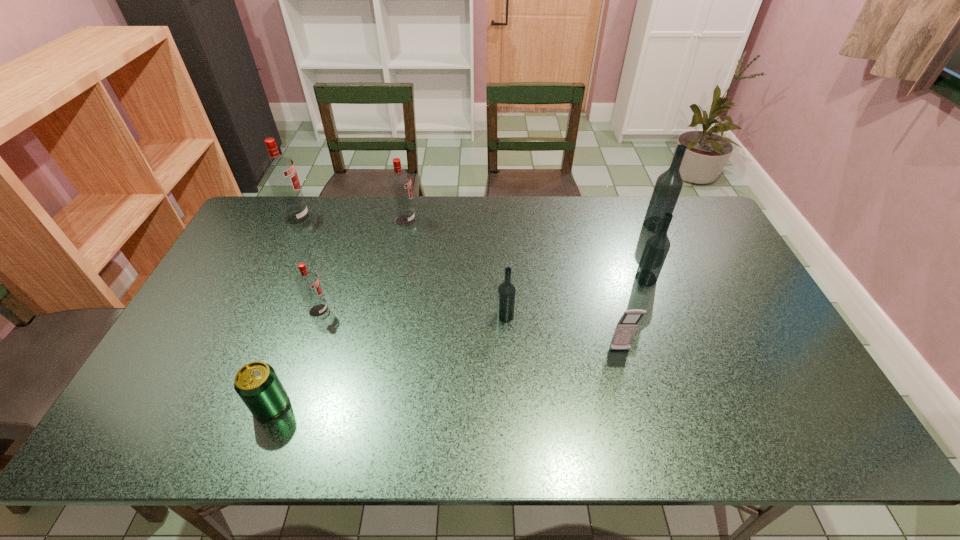
Where is `black vodka that is the closest to the smallest red vodka`? This screenshot has height=540, width=960. black vodka that is the closest to the smallest red vodka is located at coordinates (506, 297).

Where is `black vodka that stands as the third closest to the gray cellular telephone`? The image size is (960, 540). black vodka that stands as the third closest to the gray cellular telephone is located at coordinates (668, 186).

Image resolution: width=960 pixels, height=540 pixels. In order to click on vacant space that satisfies the following two spatial constraints: 1. on the front label of the second nearest black vodka; 2. on the right side of the rightmost red vodka in this screenshot , I will do `click(394, 278)`.

Find the location of a particular element. free space that satisfies the following two spatial constraints: 1. on the front label of the fifth vodka from left to right; 2. on the left side of the third vodka from left to right is located at coordinates point(394,278).

The height and width of the screenshot is (540, 960). Find the location of `free location that satisfies the following two spatial constraints: 1. on the front label of the fourth vodka from left to right; 2. on the right side of the leftmost red vodka`. free location that satisfies the following two spatial constraints: 1. on the front label of the fourth vodka from left to right; 2. on the right side of the leftmost red vodka is located at coordinates (251, 315).

Where is `free location that satisfies the following two spatial constraints: 1. on the front label of the leftmost red vodka; 2. on the right side of the nearest object`? Image resolution: width=960 pixels, height=540 pixels. free location that satisfies the following two spatial constraints: 1. on the front label of the leftmost red vodka; 2. on the right side of the nearest object is located at coordinates (207, 405).

This screenshot has width=960, height=540. Find the location of `vacant space that satisfies the following two spatial constraints: 1. on the back side of the rightmost object; 2. on the front label of the leftmost object`. vacant space that satisfies the following two spatial constraints: 1. on the back side of the rightmost object; 2. on the front label of the leftmost object is located at coordinates [652, 218].

This screenshot has width=960, height=540. Find the location of `vacant space that satisfies the following two spatial constraints: 1. on the front label of the nearest red vodka; 2. on the left side of the nearest black vodka`. vacant space that satisfies the following two spatial constraints: 1. on the front label of the nearest red vodka; 2. on the left side of the nearest black vodka is located at coordinates (317, 315).

Identify the location of free location that satisfies the following two spatial constraints: 1. on the front label of the farthest black vodka; 2. on the right side of the rightmost red vodka. The image size is (960, 540). pyautogui.click(x=404, y=225).